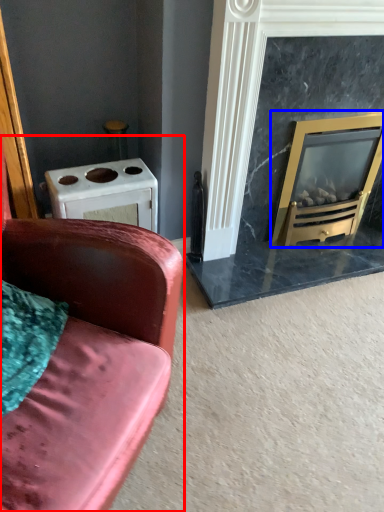
Question: Which point is further to the camera, studio couch (highlighted by a red box) or wood burning stove (highlighted by a blue box)?

Choices:
 (A) studio couch
 (B) wood burning stove

Answer: (B)